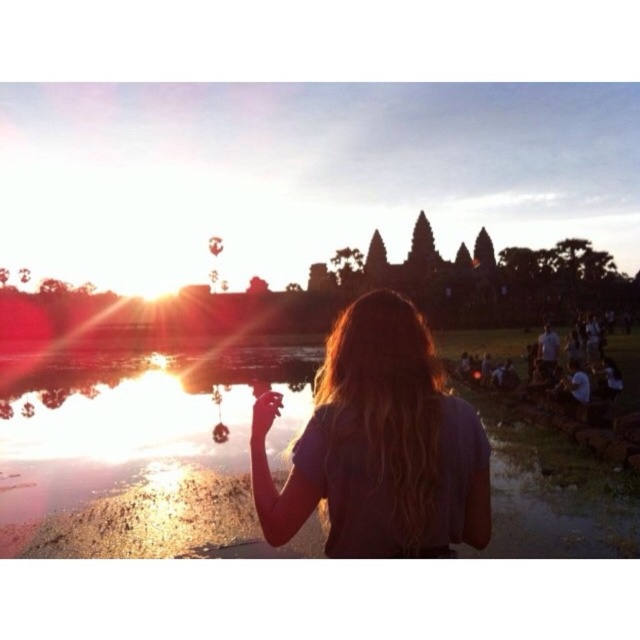
Question: Which object is closer to the camera taking this photo?

Choices:
 (A) clear water at center
 (B) blonde hair at center

Answer: (B)

Question: Among these points, which one is nearest to the camera?

Choices:
 (A) (291, 490)
 (B) (241, 493)

Answer: (A)

Question: Can you confirm if clear water at center is positioned to the left of blonde hair at center?

Choices:
 (A) yes
 (B) no

Answer: (A)

Question: Is clear water at center wider than blonde hair at center?

Choices:
 (A) yes
 (B) no

Answer: (A)

Question: Which point is farther to the camera?

Choices:
 (A) clear water at center
 (B) blonde hair at center

Answer: (A)

Question: Is clear water at center below blonde hair at center?

Choices:
 (A) yes
 (B) no

Answer: (A)